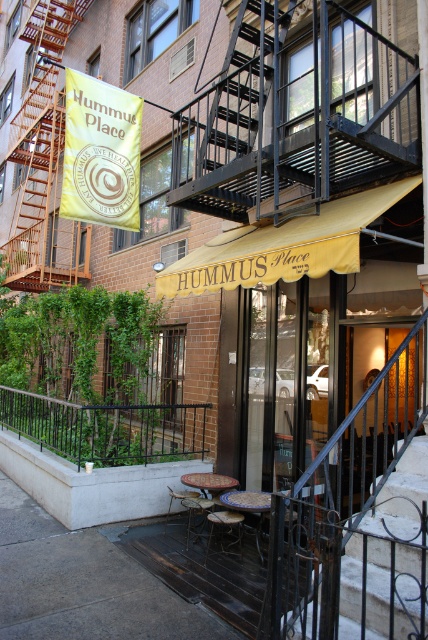
Question: Which point appears farthest from the camera in this image?

Choices:
 (A) (35, 547)
 (B) (163, 417)
 (C) (374, 560)
 (D) (32, 163)

Answer: (D)

Question: Is gray concrete pavement at lower center below black wrought iron stairs at center?

Choices:
 (A) yes
 (B) no

Answer: (A)

Question: Is wooden fire escape at left to the right of black metal railing at lower center from the viewer's perspective?

Choices:
 (A) yes
 (B) no

Answer: (B)

Question: Is gray concrete pavement at lower center wider than black wrought iron stairs at center?

Choices:
 (A) yes
 (B) no

Answer: (A)

Question: Which object is the farthest from the black wrought iron stairs at center?

Choices:
 (A) wooden fire escape at left
 (B) black metal railing at lower center

Answer: (A)

Question: Which of the following is the closest to the observer?

Choices:
 (A) black wrought iron stairs at center
 (B) wooden fire escape at left

Answer: (A)